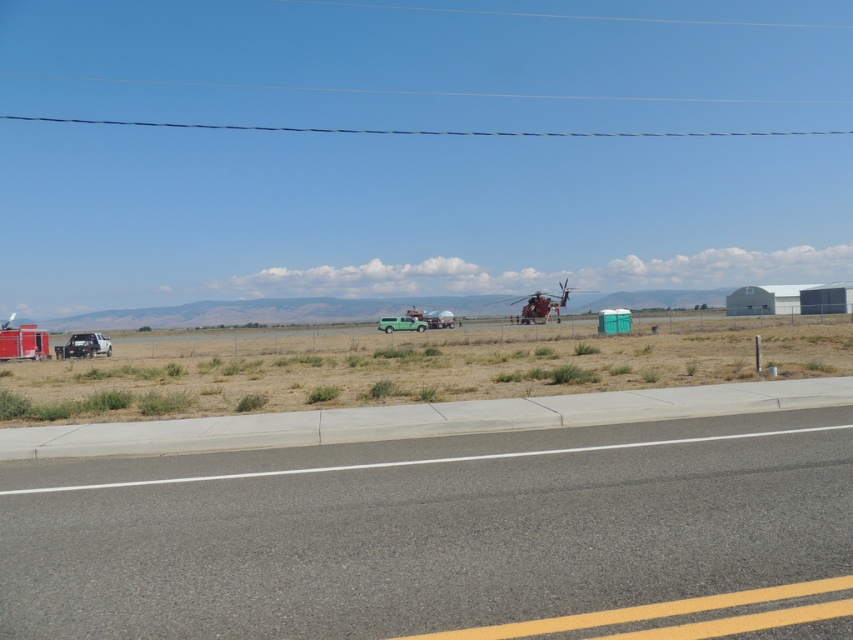
You are standing at the point with coordinates (427, 531) in the image. Based on the scene description, what surface are you currently standing on?

The point at coordinates (427, 531) corresponds to the asphalt road at center, so you are standing on the asphalt road at center.

You are driving a delivery truck that is 2.5 meters wide. You see the asphalt road at center and the green matte van at center in the image. Can your truck safely pass through the road without hitting the van?

The asphalt road at center might be wider than green matte van at center, so there is a possibility that the truck can pass safely. However, since the exact width difference isn not specified, it is recommended to proceed with caution.

You are a delivery driver who needs to park your truck in a tight space between the green matte truck at lower left and the matte black truck at left. Your truck is 2 meters wide. Can you fit your truck between them if the space between the two trucks is exactly 3 meters?

The green matte truck at lower left is wider than the matte black truck at left, but the space between them is 3 meters. Since your truck is only 2 meters wide, you can fit your truck between the green matte truck at lower left and the matte black truck at left as the available space is wider than your truck.